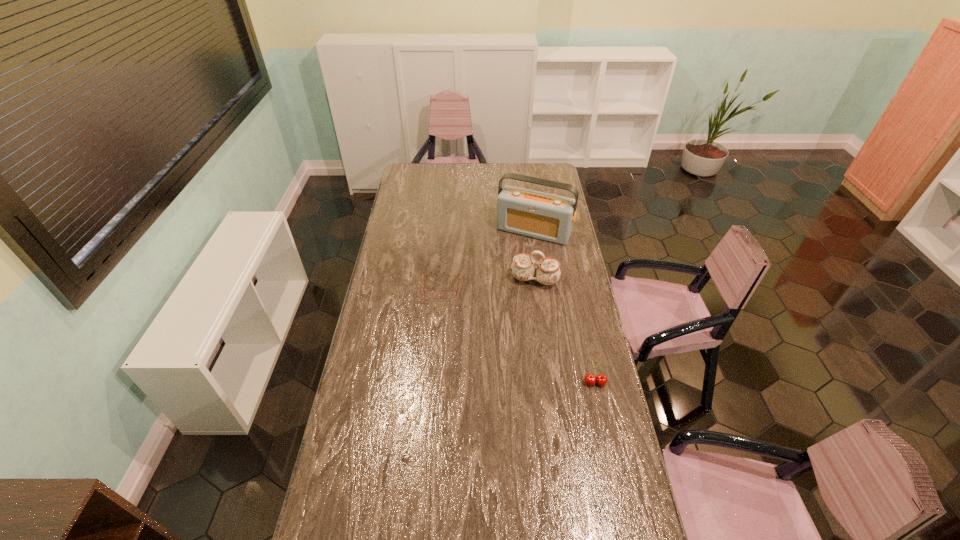
Locate an element on the screen. The width and height of the screenshot is (960, 540). free spot on the desktop that is between the shortest object and the nearest object and is positioned by the handle of the chinaware is located at coordinates (522, 337).

At what (x,y) coordinates should I click in order to perform the action: click on vacant space on the desktop that is between the leftmost object and the cherry and is positioned on the front-facing side of the farthest object. Please return your answer as a coordinate pair (x, y). Looking at the image, I should click on (492, 318).